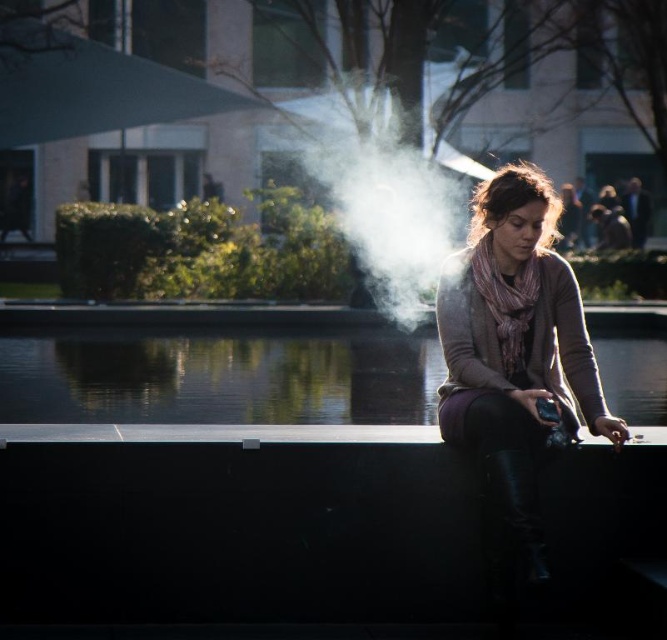
You are a photographer trying to capture the scene of the woman by the water. You notice the clear glass water at center and the white vapor at center. Which object appears taller in the image?

The white vapor at center appears taller than the clear glass water at center.

You are a photographer standing in the plaza. You want to capture the white vapor at center and the clear glass water at center in a single shot. Which object should you focus on first if you want to ensure both are in sharp focus?

The clear glass water at center is located below the white vapor at center. To ensure both are in sharp focus, focus on the white vapor at center first since it is farther away from the camera, allowing the depth of field to cover both objects.

In the scene shown: You are a photographer aiming to capture the white vapor at center rising above the black smooth ledge at center. Based on their heights, will the vapor be visible above the ledge in your photo?

The black smooth ledge at center has a lesser height compared to white vapor at center, so the vapor will be visible above the ledge in the photo.